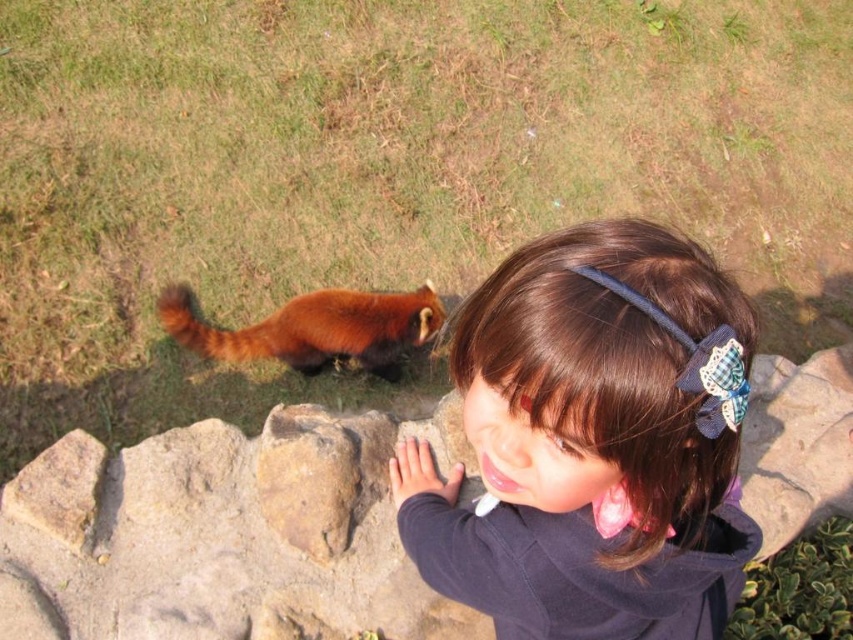
The image size is (853, 640). I want to click on brown rough stone at lower center, so click(x=224, y=534).

Based on the photo, measure the distance from brown rough stone at lower center to fluffy reddish-brown animal at lower left.

The distance of brown rough stone at lower center from fluffy reddish-brown animal at lower left is 30.20 inches.

This screenshot has width=853, height=640. Find the location of `brown rough stone at lower center`. brown rough stone at lower center is located at coordinates (224, 534).

How far apart are brown hair at upper right and brown rough stone at lower center?

brown hair at upper right is 29.36 inches from brown rough stone at lower center.

Which is behind, point (583, 278) or point (157, 504)?

Positioned behind is point (157, 504).

Is point (560, 616) farther from viewer compared to point (311, 522)?

No, (560, 616) is closer to viewer.

Identify the location of brown hair at upper right. (589, 445).

Does brown hair at upper right have a greater width compared to fluffy reddish-brown animal at lower left?

No, brown hair at upper right is not wider than fluffy reddish-brown animal at lower left.

Find the location of a particular element. This screenshot has width=853, height=640. brown hair at upper right is located at coordinates pyautogui.click(x=589, y=445).